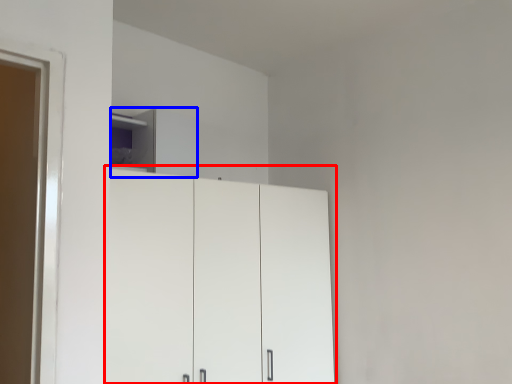
Question: Which object appears closest to the camera in this image, cupboard (highlighted by a red box) or cabinetry (highlighted by a blue box)?

Choices:
 (A) cupboard
 (B) cabinetry

Answer: (A)